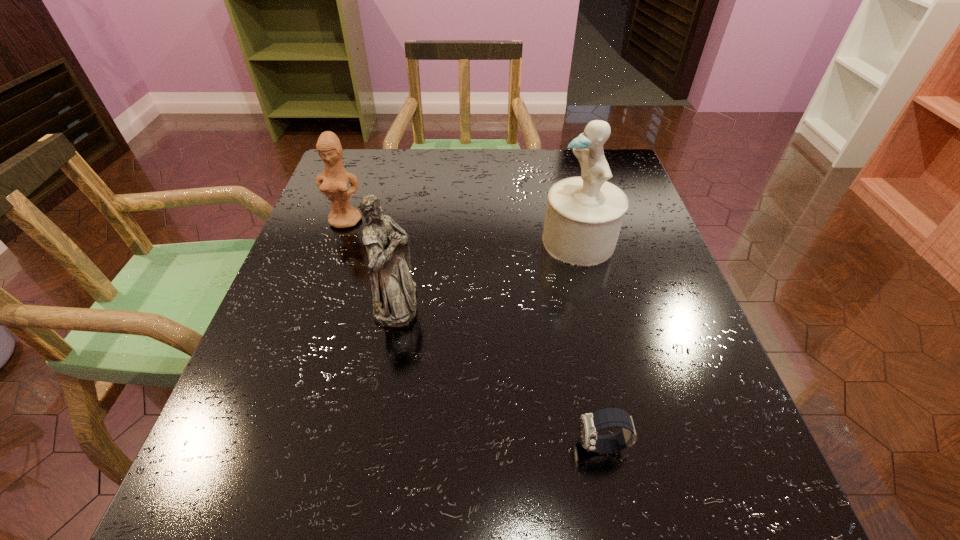
Find the location of `free space between the nearest object and the leftmost object`. free space between the nearest object and the leftmost object is located at coordinates (474, 333).

Locate an element on the screen. free space between the tallest object and the leftmost figurine is located at coordinates (463, 231).

The height and width of the screenshot is (540, 960). I want to click on unoccupied position between the watch and the rightmost figurine, so click(590, 343).

Find the location of a particular element. The width and height of the screenshot is (960, 540). empty space that is in between the shortest object and the third object from right to left is located at coordinates 499,374.

Find the location of a particular element. The height and width of the screenshot is (540, 960). object that is the second closest to the second figurine from left to right is located at coordinates (584, 214).

Locate an element on the screen. Image resolution: width=960 pixels, height=540 pixels. object that is the third closest to the rightmost figurine is located at coordinates (333, 183).

The width and height of the screenshot is (960, 540). I want to click on the second closest figurine to the tallest figurine, so point(333,183).

Identify which figurine is the third closest to the shortest object. Please provide its 2D coordinates. Your answer should be formatted as a tuple, i.e. [(x, y)], where the tuple contains the x and y coordinates of a point satisfying the conditions above.

[(333, 183)]